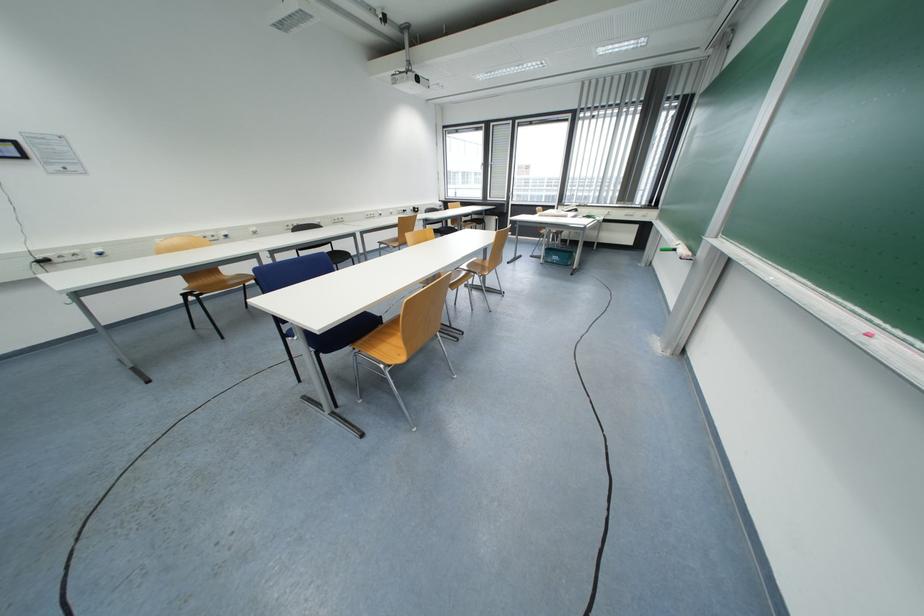
Where would you sit the blue chair surface? Please return your answer as a coordinate pair (x, y).

(338, 256)